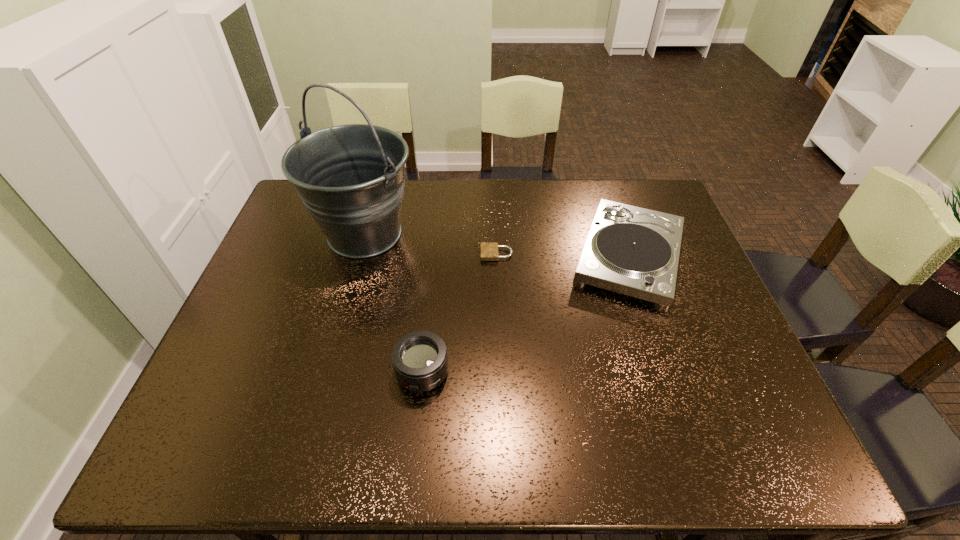
Identify the location of blank space located on the keyhole side of the third object from left to right. Image resolution: width=960 pixels, height=540 pixels. (368, 254).

Find the location of a particular element. Image resolution: width=960 pixels, height=540 pixels. bucket that is at the far edge is located at coordinates (351, 178).

Where is `record player present at the far edge`? The width and height of the screenshot is (960, 540). record player present at the far edge is located at coordinates (634, 251).

Find the location of a particular element. The width and height of the screenshot is (960, 540). object situated at the left edge is located at coordinates (351, 178).

Locate an element on the screen. This screenshot has width=960, height=540. object that is at the right edge is located at coordinates (634, 251).

This screenshot has width=960, height=540. What are the coordinates of `object that is at the far left corner` in the screenshot? It's located at (351, 178).

At what (x,y) coordinates should I click in order to perform the action: click on object present at the far right corner. Please return your answer as a coordinate pair (x, y). Image resolution: width=960 pixels, height=540 pixels. Looking at the image, I should click on (634, 251).

The image size is (960, 540). In the image, there is a desktop. Find the location of `free region at the far edge`. free region at the far edge is located at coordinates (562, 202).

The image size is (960, 540). In order to click on blank space at the near edge of the desktop in this screenshot , I will do `click(340, 441)`.

In order to click on free space at the left edge of the desktop in this screenshot , I will do `click(238, 379)`.